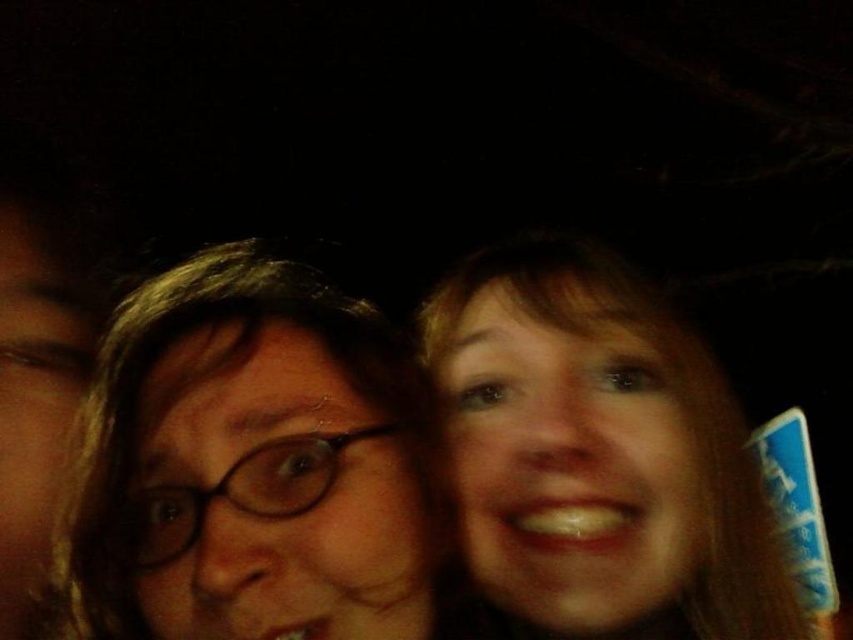
In the nighttime scene with three people, where the background is dark, you notice two features labeled as matte brown hair at center and smooth skin face at right. From the perspective of someone looking at the image, which of these two features is positioned farther to the left?

The matte brown hair at center is positioned to the left of the smooth skin face at right, so the matte brown hair at center is farther to the left.

You are holding a flashlight and want to shine it on the point at coordinates point (395, 637). Given that your flashlight has a maximum range of 20 inches, will it reach the point?

The point (395, 637) is 19.61 inches away from you, so yes, the flashlight can reach it since it is within the 20 inch range.

You are a photographer adjusting your camera settings to focus on the matte brown hair at center in the image. The camera requires coordinates to set the focus point. What are the coordinates where you should set the focus point?

The coordinates for the matte brown hair at center are at point (254, 465). Therefore, you should set the focus point at those coordinates.